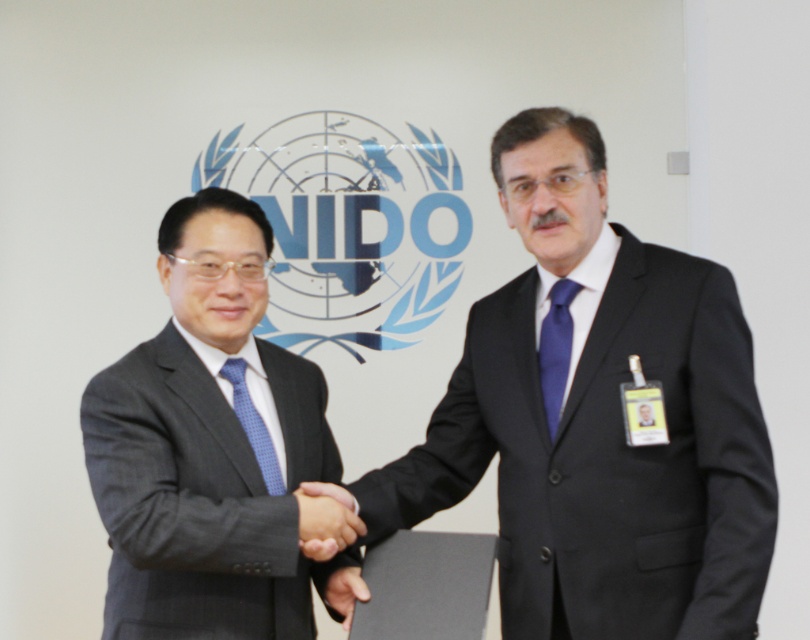
You are standing in the professional setting shown in the image and want to walk towards the wall with the logo. Which point, point [243,474] or point [333,541], is closer to you as you face the wall?

Point [243,474] is closer to you because it is further to the viewer than point [333,541], meaning it is nearer to your current position when facing the wall.

You are a photographer at the event and need to capture a clear shot of both the matte black suit at left and the matte black hand at center. Can you focus on both objects simultaneously without any obstruction?

The matte black suit at left is positioned over the matte black hand at center, so focusing on both simultaneously may be challenging due to the overlapping positioning.